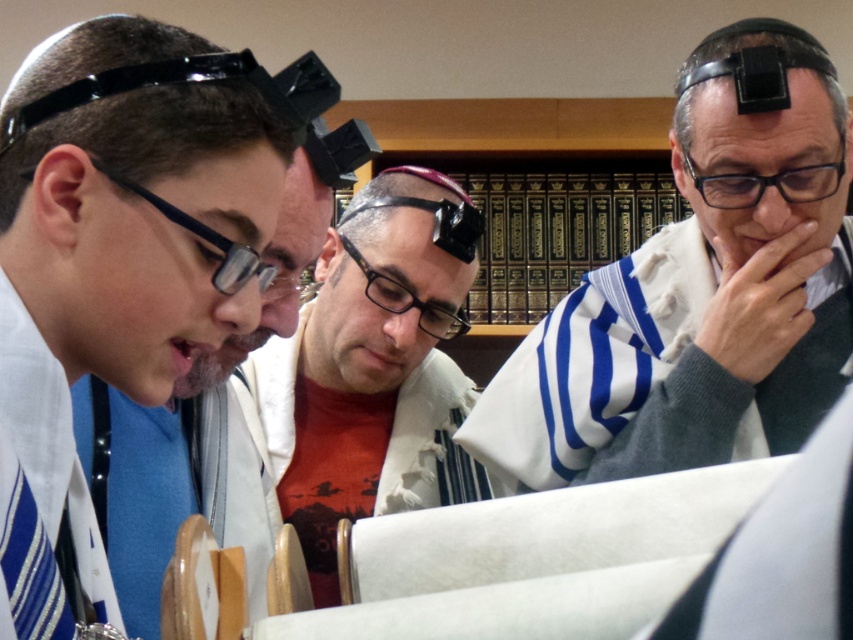
Question: Is white textured kippah at left to the left of blue striped tie at lower left from the viewer's perspective?

Choices:
 (A) no
 (B) yes

Answer: (A)

Question: Where is white striped shawl at center located in relation to black matte goggles at center in the image?

Choices:
 (A) below
 (B) above

Answer: (A)

Question: Which of the following is the farthest from the observer?

Choices:
 (A) (170, 216)
 (B) (761, 180)

Answer: (B)

Question: Considering the real-world distances, which object is farthest from the black plastic glasses at center?

Choices:
 (A) black plastic glasses at upper right
 (B) white striped shawl at center
 (C) matte black glasses at center
 (D) black matte goggles at center

Answer: (A)

Question: Which point is farther to the camera?

Choices:
 (A) (386, 308)
 (B) (782, 177)

Answer: (A)

Question: Does blue striped tie at lower left appear under black plastic glasses at upper right?

Choices:
 (A) no
 (B) yes

Answer: (B)